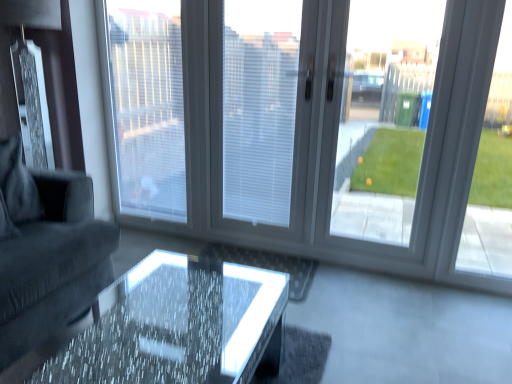
Question: From a real-world perspective, is white textured blinds at center, positioned as the 1th window screen in left-to-right order, above or below white plastic window frame at right?

Choices:
 (A) below
 (B) above

Answer: (B)

Question: Is point pos(123,84) positioned closer to the camera than point pos(487,56)?

Choices:
 (A) closer
 (B) farther

Answer: (B)

Question: Which object is positioned farthest from the white textured blinds at center, positioned as the 3th window screen in right-to-left order?

Choices:
 (A) dark gray fabric couch at left
 (B) white textured blinds at center, which ranks as the second window screen in right-to-left order
 (C) transparent glass door at right, arranged as the 1th window screen when viewed from the right
 (D) white plastic window frame at right
 (E) transparent glass window at center

Answer: (C)

Question: Which object is positioned closest to the transparent glass door at right, arranged as the 3th window screen when viewed from the left?

Choices:
 (A) transparent glass window at center
 (B) white textured blinds at center, positioned as the 1th window screen in left-to-right order
 (C) dark gray fabric couch at left
 (D) translucent glass table at center
 (E) white textured blinds at center, which ranks as the second window screen in right-to-left order

Answer: (A)